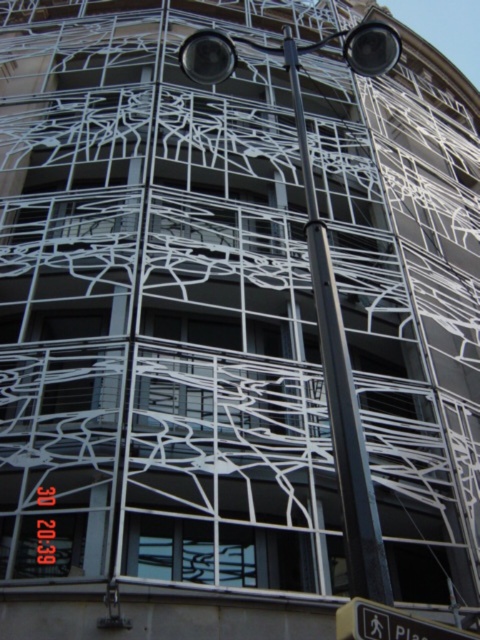
Question: Where is black metal pole at center located in relation to yellow plastic pedestrian sign at lower right in the image?

Choices:
 (A) below
 (B) above

Answer: (B)

Question: Among these points, which one is farthest from the camera?

Choices:
 (A) (391, 605)
 (B) (348, 499)

Answer: (B)

Question: Which object is farther from the camera taking this photo?

Choices:
 (A) yellow plastic pedestrian sign at lower right
 (B) black metal pole at center

Answer: (B)

Question: Does black metal pole at center have a smaller size compared to yellow plastic pedestrian sign at lower right?

Choices:
 (A) yes
 (B) no

Answer: (B)

Question: Which point is closer to the camera?

Choices:
 (A) yellow plastic pedestrian sign at lower right
 (B) black metal pole at center

Answer: (A)

Question: Observing the image, what is the correct spatial positioning of black metal pole at center in reference to yellow plastic pedestrian sign at lower right?

Choices:
 (A) right
 (B) left

Answer: (B)